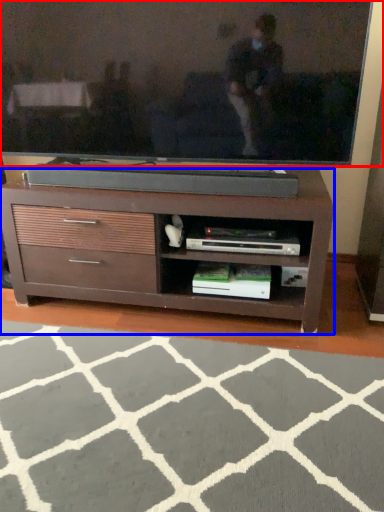
Question: Which point is closer to the camera, television (highlighted by a red box) or chest of drawers (highlighted by a blue box)?

Choices:
 (A) television
 (B) chest of drawers

Answer: (A)